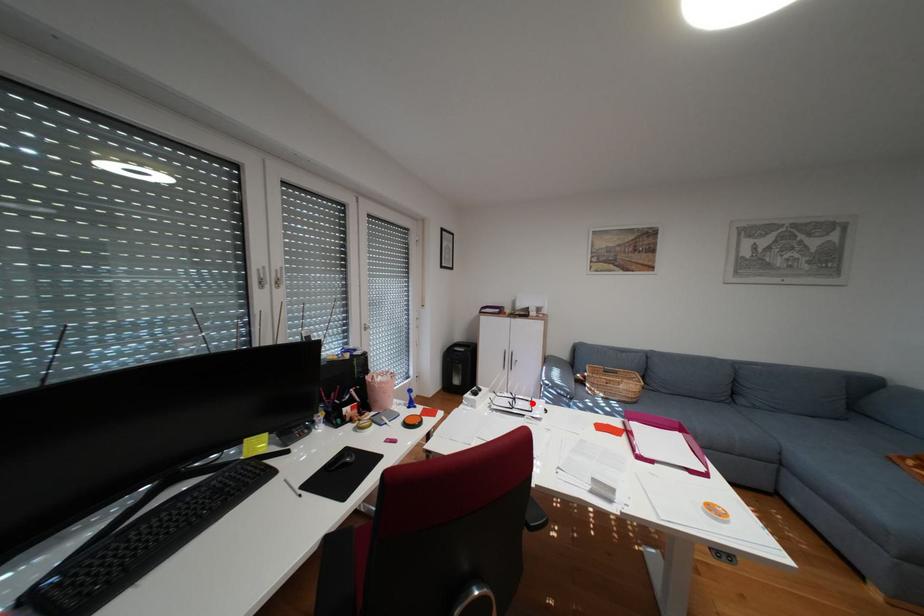
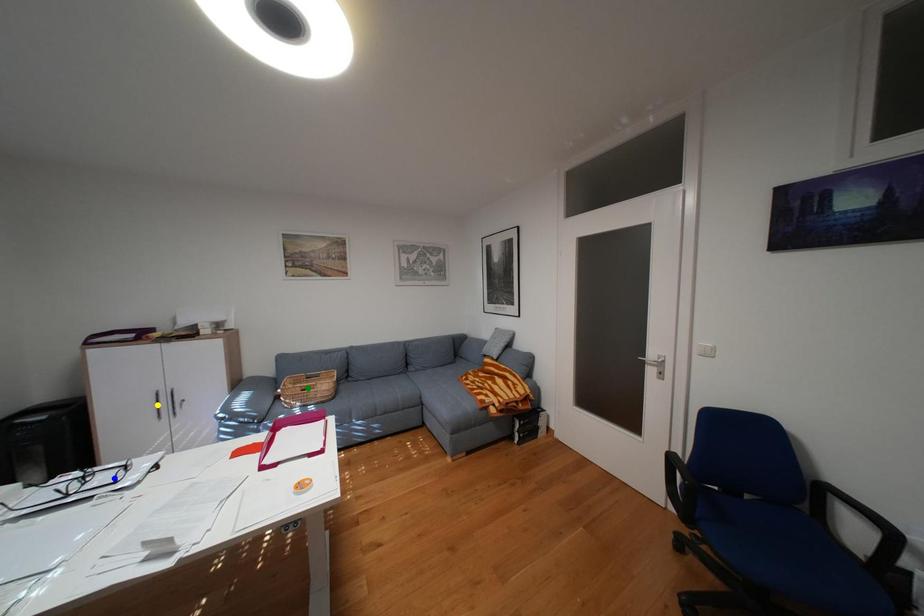
Question: I am providing you with two images of the same scene from different viewpoints. A red point is marked on the first image. You are given multiple points on the second image. Which point in image 2 represents the same 3d spot as the red point in image 1?

Choices:
 (A) yellow point
 (B) blue point
 (C) green point

Answer: (B)